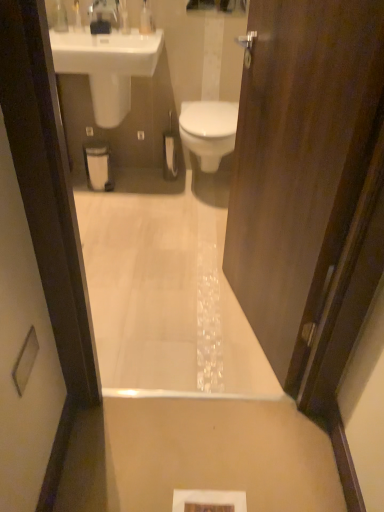
Where is `clear plastic bottle at upper left, which appears as the third toiletry when viewed from the right`? clear plastic bottle at upper left, which appears as the third toiletry when viewed from the right is located at coordinates (60, 16).

You are a GUI agent. You are given a task and a screenshot of the screen. Output one action in this format:
    pyautogui.click(x=<x>, y=<y>)
    Task: Click on the white glossy bath at center
    The width and height of the screenshot is (384, 512).
    Given the screenshot: What is the action you would take?
    pyautogui.click(x=160, y=298)

The width and height of the screenshot is (384, 512). In order to click on white glossy bidet at center in this screenshot , I will do `click(209, 131)`.

The height and width of the screenshot is (512, 384). I want to click on satin nickel faucet at upper center, so click(104, 12).

Identify the location of translucent plastic soap dispenser at upper center, arranged as the second toiletry when viewed from the right. Image resolution: width=384 pixels, height=512 pixels. (123, 17).

Where is `clear plastic bottle at upper left, placed as the 1th toiletry when sorted from left to right`? The image size is (384, 512). clear plastic bottle at upper left, placed as the 1th toiletry when sorted from left to right is located at coordinates (60, 16).

Between clear plastic bottle at upper left, placed as the 1th toiletry when sorted from left to right, and satin nickel faucet at upper center, which one has less height?

satin nickel faucet at upper center.

This screenshot has height=512, width=384. In order to click on toiletry that is the 2nd object located below the satin nickel faucet at upper center (from the image's perspective) in this screenshot , I will do `click(60, 16)`.

From a real-world perspective, is clear plastic bottle at upper left, placed as the 1th toiletry when sorted from left to right, physically below satin nickel faucet at upper center?

Yes.

Which point is more distant from viewer, (60, 25) or (95, 12)?

The point (95, 12) is farther from the camera.

Considering the relative sizes of clear plastic bottle at upper center, arranged as the third toiletry when viewed from the left, and white glossy bath at center in the image provided, is clear plastic bottle at upper center, arranged as the third toiletry when viewed from the left, taller than white glossy bath at center?

Yes.

From a real-world perspective, count 3rd toiletrys upward from the white glossy bath at center and point to it. Please provide its 2D coordinates.

[(146, 19)]

Which of these two, clear plastic bottle at upper center, the first toiletry positioned from the right, or white glossy bath at center, is smaller?

With smaller size is clear plastic bottle at upper center, the first toiletry positioned from the right.

From a real-world perspective, is clear plastic bottle at upper center, arranged as the third toiletry when viewed from the left, positioned under white glossy bath at center based on gravity?

Incorrect, from a real-world perspective, clear plastic bottle at upper center, arranged as the third toiletry when viewed from the left, is higher than white glossy bath at center.

Consider the image. Does clear plastic bottle at upper left, which appears as the third toiletry when viewed from the right, have a greater height compared to translucent plastic soap dispenser at upper center, the 2th toiletry viewed from the left?

Correct, clear plastic bottle at upper left, which appears as the third toiletry when viewed from the right, is much taller as translucent plastic soap dispenser at upper center, the 2th toiletry viewed from the left.

Image resolution: width=384 pixels, height=512 pixels. I want to click on toiletry to the left of translucent plastic soap dispenser at upper center, the 2th toiletry viewed from the left, so click(x=60, y=16).

Is point (60, 17) closer or farther from the camera than point (122, 13)?

Point (60, 17) appears to be closer to the viewer than point (122, 13).

Is clear plastic bottle at upper left, which appears as the third toiletry when viewed from the right, bigger than translucent plastic soap dispenser at upper center, arranged as the second toiletry when viewed from the right?

Yes, clear plastic bottle at upper left, which appears as the third toiletry when viewed from the right, is bigger than translucent plastic soap dispenser at upper center, arranged as the second toiletry when viewed from the right.

Is translucent plastic soap dispenser at upper center, the 2th toiletry viewed from the left, wider or thinner than white glossy bath at center?

translucent plastic soap dispenser at upper center, the 2th toiletry viewed from the left, is thinner than white glossy bath at center.

Between translucent plastic soap dispenser at upper center, the 2th toiletry viewed from the left, and white glossy bath at center, which one has less height?

white glossy bath at center.

Is white glossy bath at center at the back of translucent plastic soap dispenser at upper center, arranged as the second toiletry when viewed from the right?

No, translucent plastic soap dispenser at upper center, arranged as the second toiletry when viewed from the right, is not facing away from white glossy bath at center.

From the image's perspective, is translucent plastic soap dispenser at upper center, arranged as the second toiletry when viewed from the right, above or below white glossy bath at center?

From the image's perspective, translucent plastic soap dispenser at upper center, arranged as the second toiletry when viewed from the right, appears above white glossy bath at center.

The width and height of the screenshot is (384, 512). Identify the location of bidet below the clear plastic bottle at upper left, which appears as the third toiletry when viewed from the right (from the image's perspective). (209, 131).

From the picture: From a real-world perspective, which object rests below the other?

white glossy bidet at center, from a real-world perspective.

From the image's perspective, which one is positioned higher, white glossy bidet at center or clear plastic bottle at upper left, which appears as the third toiletry when viewed from the right?

clear plastic bottle at upper left, which appears as the third toiletry when viewed from the right, is shown above in the image.

Is white glossy bidet at center turned away from clear plastic bottle at upper left, placed as the 1th toiletry when sorted from left to right?

No, clear plastic bottle at upper left, placed as the 1th toiletry when sorted from left to right, is not at the back of white glossy bidet at center.

Image resolution: width=384 pixels, height=512 pixels. In order to click on sink that appears in front of the clear plastic bottle at upper left, which appears as the third toiletry when viewed from the right in this screenshot , I will do `click(107, 66)`.

Is white glossy sink at upper left aimed at clear plastic bottle at upper left, which appears as the third toiletry when viewed from the right?

No, white glossy sink at upper left does not turn towards clear plastic bottle at upper left, which appears as the third toiletry when viewed from the right.

Is white glossy sink at upper left far from clear plastic bottle at upper left, which appears as the third toiletry when viewed from the right?

No, white glossy sink at upper left is not far from clear plastic bottle at upper left, which appears as the third toiletry when viewed from the right.

From the image's perspective, which one is positioned lower, white glossy sink at upper left or clear plastic bottle at upper left, placed as the 1th toiletry when sorted from left to right?

white glossy sink at upper left, from the image's perspective.

From the image's perspective, would you say clear plastic bottle at upper center, arranged as the third toiletry when viewed from the left, is positioned over glossy glass mirror at upper center?

Actually, clear plastic bottle at upper center, arranged as the third toiletry when viewed from the left, appears below glossy glass mirror at upper center in the image.

Are clear plastic bottle at upper center, the first toiletry positioned from the right, and glossy glass mirror at upper center far apart?

clear plastic bottle at upper center, the first toiletry positioned from the right, is near glossy glass mirror at upper center, not far away.

Which of these two, clear plastic bottle at upper center, arranged as the third toiletry when viewed from the left, or glossy glass mirror at upper center, is bigger?

Bigger between the two is glossy glass mirror at upper center.

Does point (150, 14) lie behind point (190, 3)?

That is True.

Where is `the 1st toiletry behind the satin nickel faucet at upper center`? Image resolution: width=384 pixels, height=512 pixels. the 1st toiletry behind the satin nickel faucet at upper center is located at coordinates (60, 16).

Which toiletry is the 1st one when counting from the left side of the white glossy bath at center? Please provide its 2D coordinates.

[(146, 19)]

Which object lies nearer to the anchor point clear plastic bottle at upper left, which appears as the third toiletry when viewed from the right, white glossy sink at upper left or satin nickel faucet at upper center?

satin nickel faucet at upper center is closer to clear plastic bottle at upper left, which appears as the third toiletry when viewed from the right.

In the scene shown: Which object lies further to the anchor point white glossy bidet at center, satin nickel faucet at upper center or dark wood door at center?

dark wood door at center is positioned further to the anchor white glossy bidet at center.

Based on their spatial positions, is dark wood door at center or white glossy sink at upper left closer to glossy glass mirror at upper center?

white glossy sink at upper left is closer to glossy glass mirror at upper center.

When comparing their distances from translucent plastic soap dispenser at upper center, the 2th toiletry viewed from the left, does clear plastic bottle at upper left, which appears as the third toiletry when viewed from the right, or satin nickel faucet at upper center seem further?

clear plastic bottle at upper left, which appears as the third toiletry when viewed from the right, is positioned further to the anchor translucent plastic soap dispenser at upper center, the 2th toiletry viewed from the left.

When comparing their distances from clear plastic bottle at upper center, arranged as the third toiletry when viewed from the left, does dark wood door at center or white glossy bidet at center seem further?

dark wood door at center lies further to clear plastic bottle at upper center, arranged as the third toiletry when viewed from the left, than the other object.

Looking at the image, which one is located closer to glossy glass mirror at upper center, clear plastic bottle at upper center, the first toiletry positioned from the right, or white glossy bidet at center?

clear plastic bottle at upper center, the first toiletry positioned from the right, lies closer to glossy glass mirror at upper center than the other object.

Considering their positions, is white glossy bidet at center positioned further to dark wood door at center than glossy glass mirror at upper center?

glossy glass mirror at upper center.

Which object lies further to the anchor point white glossy bidet at center, satin nickel faucet at upper center or clear plastic bottle at upper left, which appears as the third toiletry when viewed from the right?

clear plastic bottle at upper left, which appears as the third toiletry when viewed from the right, lies further to white glossy bidet at center than the other object.

The width and height of the screenshot is (384, 512). Identify the location of toiletry located between translucent plastic soap dispenser at upper center, the 2th toiletry viewed from the left, and glossy glass mirror at upper center in the left-right direction. (146, 19).

In order to click on faucet between dark wood door at center and glossy glass mirror at upper center in the front-back direction in this screenshot , I will do `click(104, 12)`.

Locate an element on the screen. The image size is (384, 512). mirror located between dark wood door at center and clear plastic bottle at upper center, the first toiletry positioned from the right, in the depth direction is located at coordinates (218, 5).

You are a GUI agent. You are given a task and a screenshot of the screen. Output one action in this format:
    pyautogui.click(x=<x>, y=<y>)
    Task: Click on the sink between clear plastic bottle at upper left, placed as the 1th toiletry when sorted from left to right, and glossy glass mirror at upper center
    The height and width of the screenshot is (512, 384).
    Given the screenshot: What is the action you would take?
    pyautogui.click(x=107, y=66)